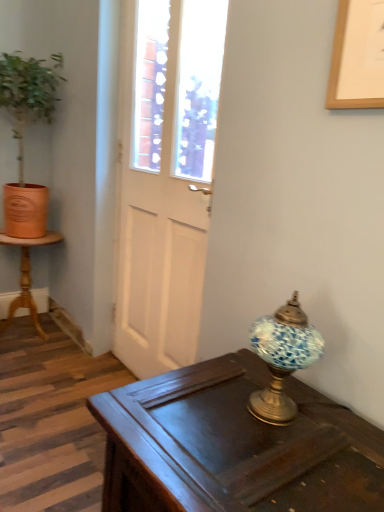
Question: From their relative heights in the image, would you say wooden picture frame at upper right is taller or shorter than terracotta pot at left?

Choices:
 (A) tall
 (B) short

Answer: (B)

Question: Do you think wooden picture frame at upper right is within terracotta pot at left, or outside of it?

Choices:
 (A) inside
 (B) outside

Answer: (B)

Question: Considering the real-world distances, which object is farthest from the dark wood desk at center?

Choices:
 (A) blue mosaic glass lamp at right
 (B) wooden pedestal table at left
 (C) terracotta pot at left
 (D) wooden picture frame at upper right
 (E) white glossy door at center

Answer: (C)

Question: Which object is positioned farthest from the blue mosaic glass lamp at right?

Choices:
 (A) wooden picture frame at upper right
 (B) white glossy door at center
 (C) terracotta pot at left
 (D) dark wood desk at center
 (E) wooden pedestal table at left

Answer: (C)